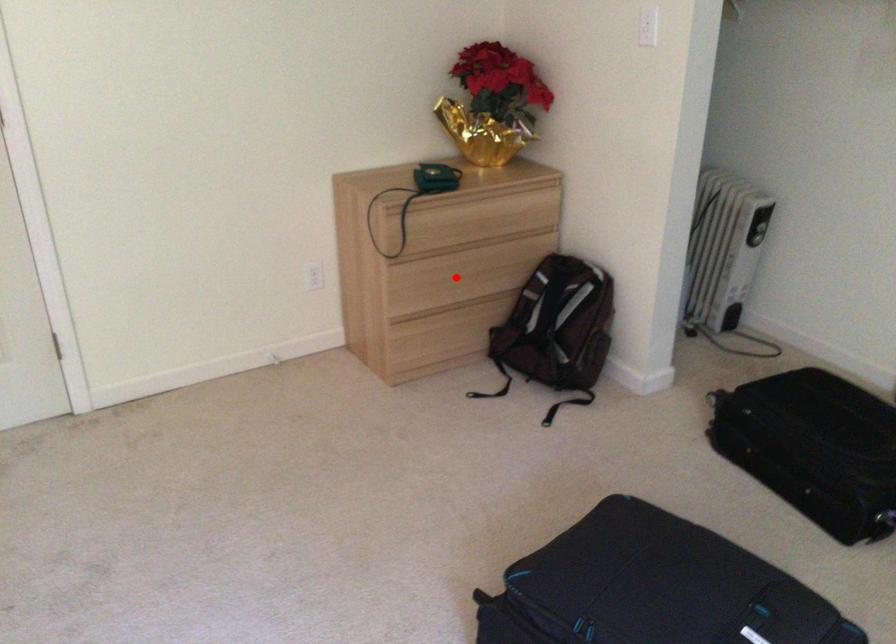
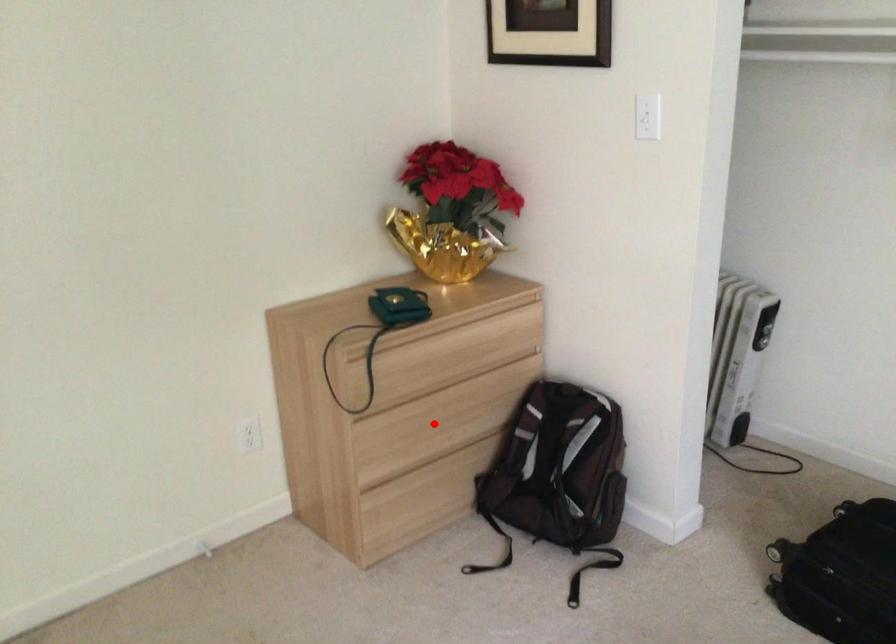
I am providing you with two images of the same scene from different viewpoints. A red point is marked on the first image and another point is marked on the second image. Do the highlighted points in image1 and image2 indicate the same real-world spot?

Yes